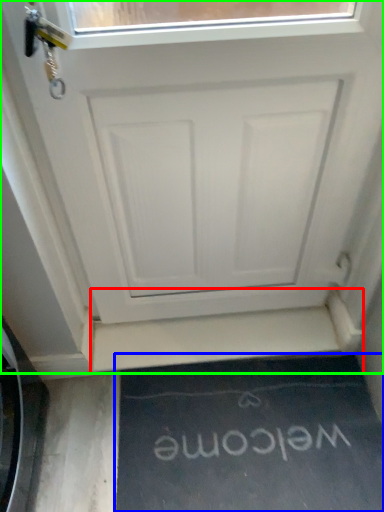
Question: Estimate the real-world distances between objects in this image. Which object is closer to stairwell (highlighted by a red box), doormat (highlighted by a blue box) or door (highlighted by a green box)?

Choices:
 (A) doormat
 (B) door

Answer: (A)